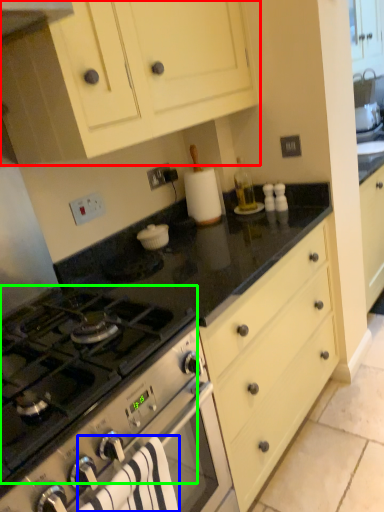
Question: Considering the real-world distances, which object is closest to cabinetry (highlighted by a red box)? bath towel (highlighted by a blue box) or gas stove (highlighted by a green box).

Choices:
 (A) bath towel
 (B) gas stove

Answer: (B)